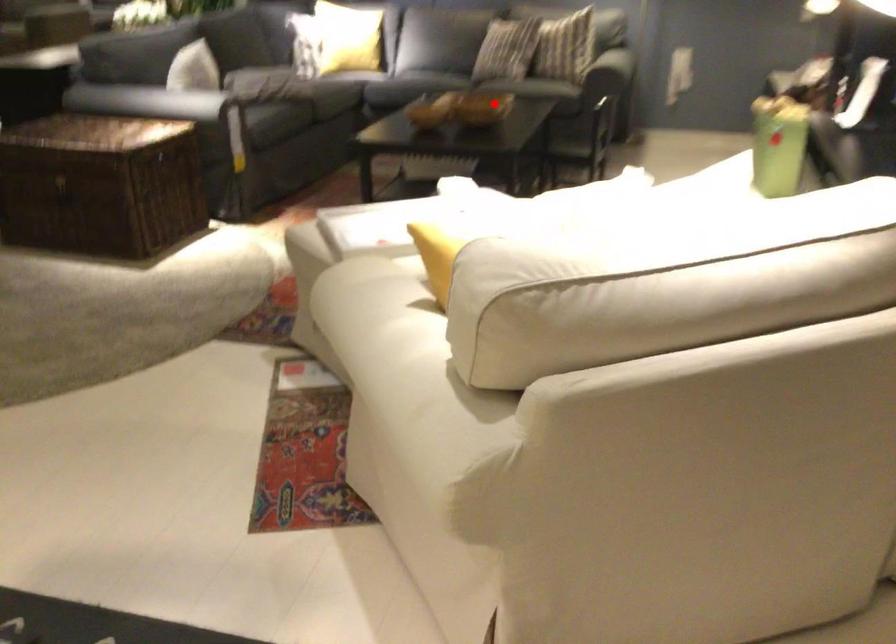
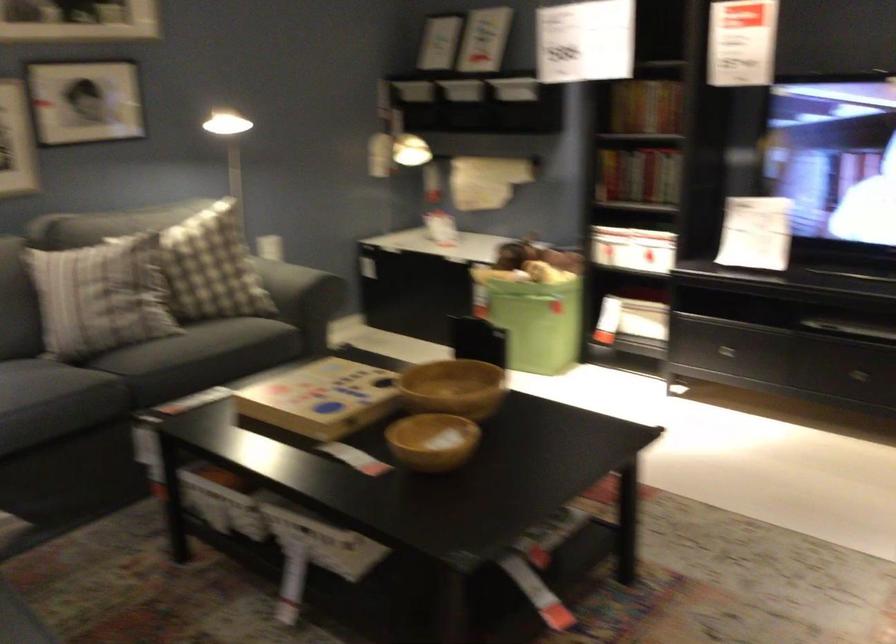
Question: I am providing you with two images of the same scene from different viewpoints. In image1, a red point is highlighted. Considering the same 3D point in image2, which of the following is correct?

Choices:
 (A) It is closer
 (B) It is farther

Answer: (A)